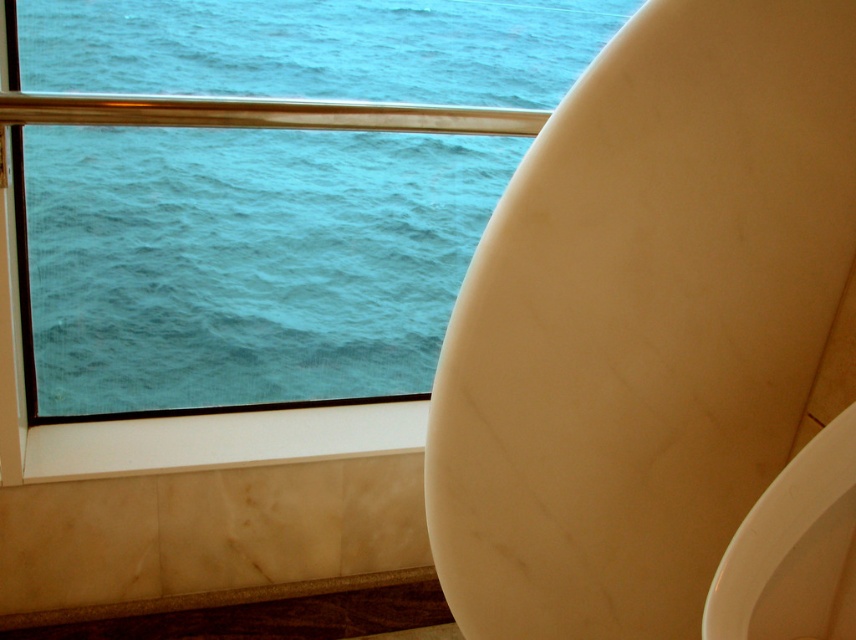
You are a plumber inspecting the bathroom. You need to replace the urinal that is taller. Which one should you choose between the white marble urinal at right and the white glossy urinal at lower right?

The white marble urinal at right is taller than the white glossy urinal at lower right, so you should choose the white marble urinal at right for replacement.

You are a maintenance worker in a bathroom. You need to clean both the white glossy urinal at lower right and the marble ledge at lower left. Which object should you clean first if you want to start with the one closer to the entrance door?

The white glossy urinal at lower right is in front of the marble ledge at lower left, so it is closer to the entrance door. Therefore, you should clean the white glossy urinal at lower right first.

You are standing in the bathroom and want to take a photo of the ocean through the window. You notice two points marked in the image. Which point, point (x=817, y=522) or point (x=432, y=584), is closer to your camera lens when taking the photo?

Point (x=817, y=522) is closer to the camera lens than point (x=432, y=584).